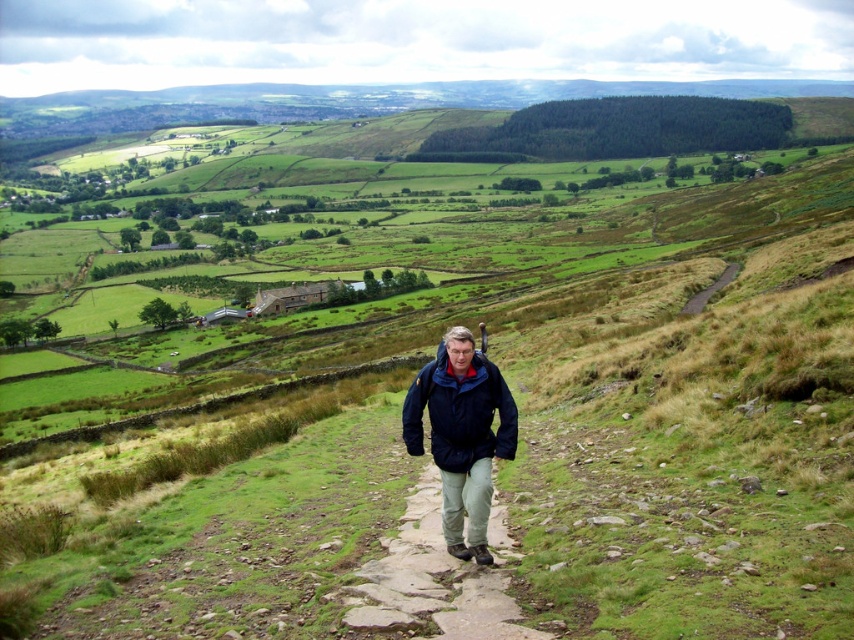
Looking at this image, you are a hiker who has just started walking on the stone paved path at center. Where exactly on the path should you step to stay on the path?

The stone paved path at center is located at point (431,580), so you should step there to stay on the path.

You are standing at the point marked as point (431, 580) in the image. What is the surface material of the path you are currently standing on?

The surface material of the path at point (431, 580) is stone paved path at center.

You are a photographer positioned at the camera location in the image. You want to take a photo that includes both the point at coordinate (376, 604) and the point at (447, 385). Which point will appear larger in the photo?

The point at coordinate (376, 604) will appear larger in the photo because it is closer to the camera than point (447, 385).